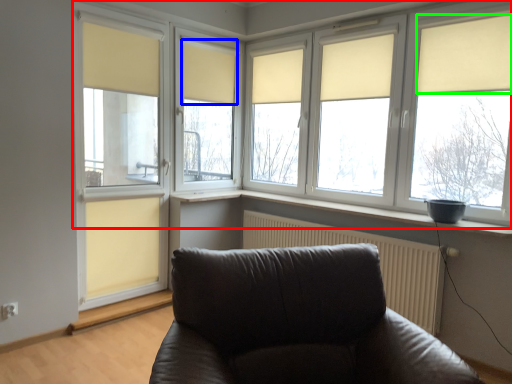
Question: Which object is the closest to the window (highlighted by a red box)? Choose among these: curtain (highlighted by a blue box) or curtain (highlighted by a green box).

Choices:
 (A) curtain
 (B) curtain

Answer: (B)